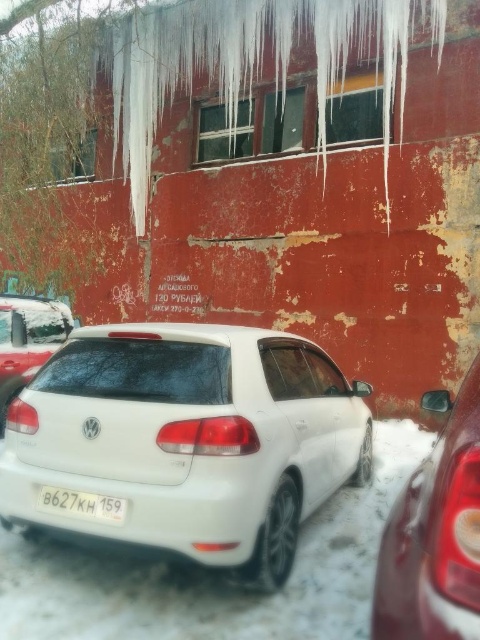
Consider the image. You are a delivery person standing next to the white glossy hatchback at center. You need to deliver a package to the red building in front of you. The package is too large to carry while walking. Can you place the package on the ground between you and the building without needing to move the car?

The distance between the white glossy hatchback at center and the red building is 7.03 feet. Since the package is too large to carry while walking, you can place it on the ground between the car and the building as there is sufficient space available.

Based on the photo, you are a delivery driver who needs to scan the license plate of the white plastic license plate at center. However, your scanner can only read plates that are in front of the white matte car at upper left. Can you scan it?

The white plastic license plate at center is behind the white matte car at upper left, so it cannot be scanned by the scanner which requires the plate to be in front of the car.

You are a delivery driver who needs to attach a package to the white plastic license plate at center of the white glossy hatchback at center. Can you place the package on the license plate without it falling off, considering the spatial relationship between the two objects?

The white glossy hatchback at center is above the white plastic license plate at center, so the license plate is located on the lower part of the car. Since the package would be placed on the license plate, it won